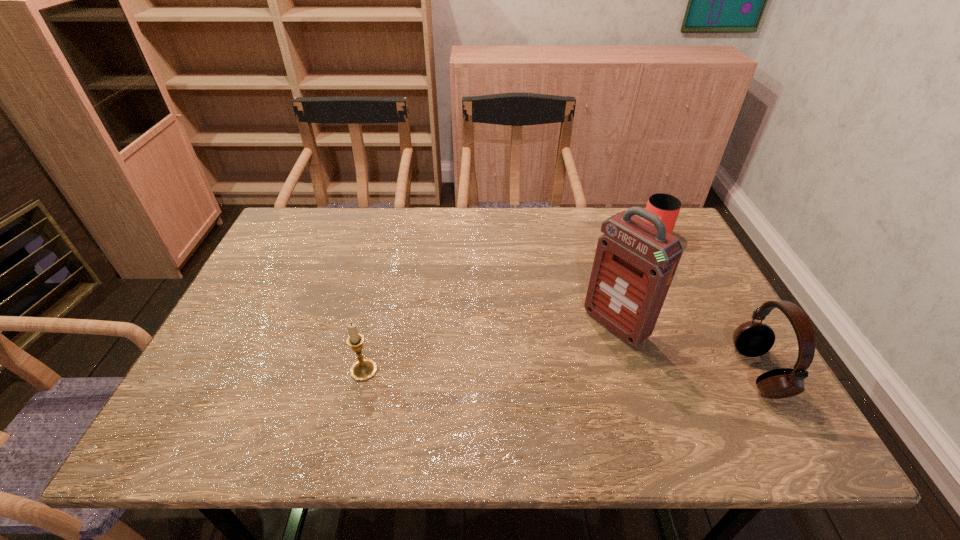
Where is `free space on the desktop that is between the second shortest object and the headset and is positioned on the handle side of the farthest object`? free space on the desktop that is between the second shortest object and the headset and is positioned on the handle side of the farthest object is located at coordinates (599, 372).

This screenshot has height=540, width=960. Find the location of `free space on the desktop that is between the leftmost object and the headset and is positioned on the front-facing side of the first-aid kit`. free space on the desktop that is between the leftmost object and the headset and is positioned on the front-facing side of the first-aid kit is located at coordinates (551, 371).